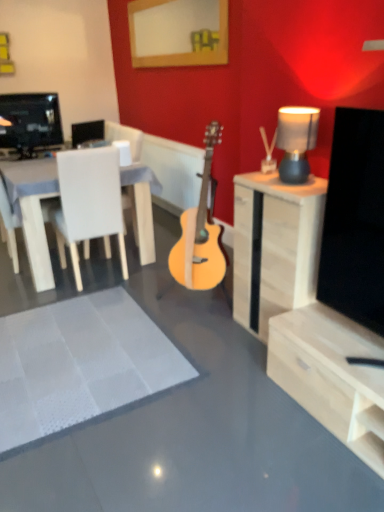
Where is `blank space above light wood cabinet at right (from a real-world perspective)`? blank space above light wood cabinet at right (from a real-world perspective) is located at coordinates (294, 184).